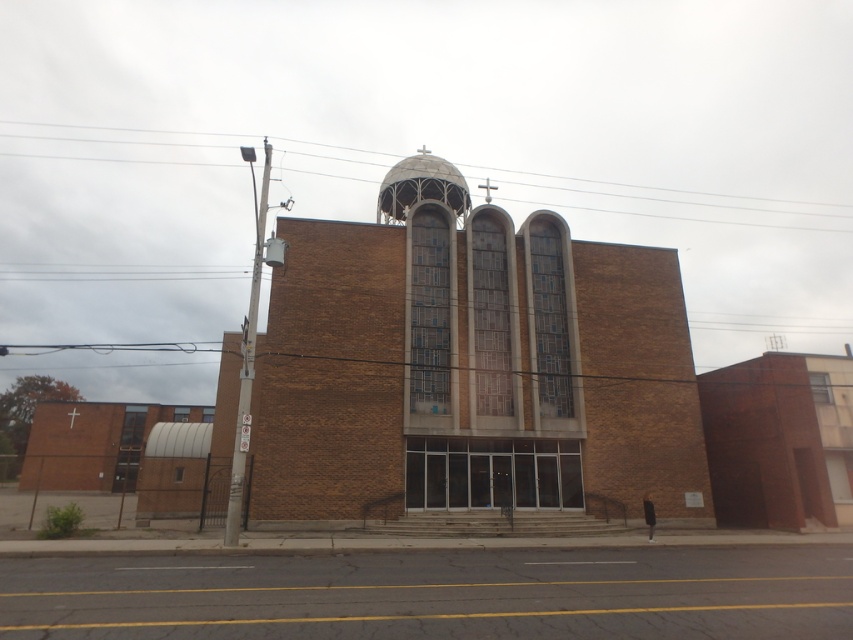
Question: Which of the following is the farthest from the observer?

Choices:
 (A) brown brick building at right
 (B) brown brick church at center

Answer: (A)

Question: Does brown brick church at center come in front of brown brick building at right?

Choices:
 (A) no
 (B) yes

Answer: (B)

Question: Which point is closer to the camera?

Choices:
 (A) (810, 492)
 (B) (544, 400)

Answer: (A)

Question: Does brown brick church at center appear under brown brick building at right?

Choices:
 (A) yes
 (B) no

Answer: (B)

Question: Where is brown brick church at center located in relation to brown brick building at right in the image?

Choices:
 (A) left
 (B) right

Answer: (A)

Question: Which point appears closest to the camera in this image?

Choices:
 (A) (456, 388)
 (B) (819, 387)

Answer: (A)